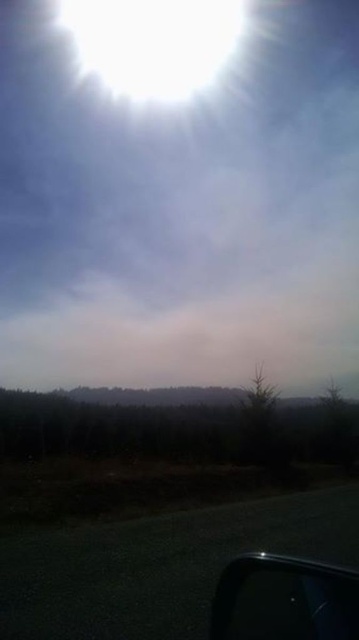
You are a driver looking at the road ahead. You notice the black asphalt highway at bottom and the bright white cloud at upper center. Which of these two objects takes up more space in your view?

The bright white cloud at upper center takes up more space than the black asphalt highway at bottom in your view.